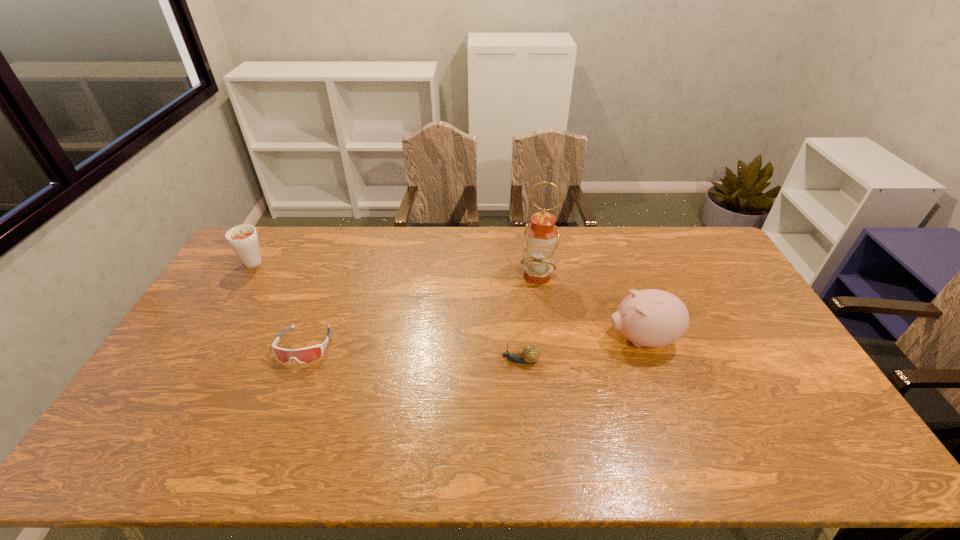
Identify the location of blank space located on the front-facing side of the goggles. This screenshot has height=540, width=960. (284, 397).

Identify the location of vacant position located on the front-facing side of the escargot. (380, 361).

Where is `free space located 0.310m on the front-facing side of the escargot`? free space located 0.310m on the front-facing side of the escargot is located at coordinates (391, 361).

Image resolution: width=960 pixels, height=540 pixels. I want to click on vacant space located 0.180m on the front-facing side of the escargot, so click(x=436, y=361).

I want to click on oil lamp situated at the far edge, so click(541, 237).

Where is `root beer located at the far edge`? This screenshot has width=960, height=540. root beer located at the far edge is located at coordinates (243, 239).

The height and width of the screenshot is (540, 960). Identify the location of object present at the left edge. (243, 239).

I want to click on object at the far left corner, so click(243, 239).

Locate an element on the screen. The image size is (960, 540). vacant space at the far edge of the desktop is located at coordinates (416, 249).

This screenshot has height=540, width=960. I want to click on free space at the left edge of the desktop, so click(x=234, y=337).